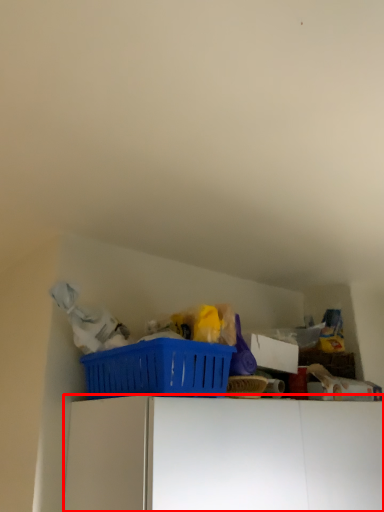
Question: From the image's perspective, where is furniture (annotated by the red box) located relative to basket?

Choices:
 (A) below
 (B) above

Answer: (A)